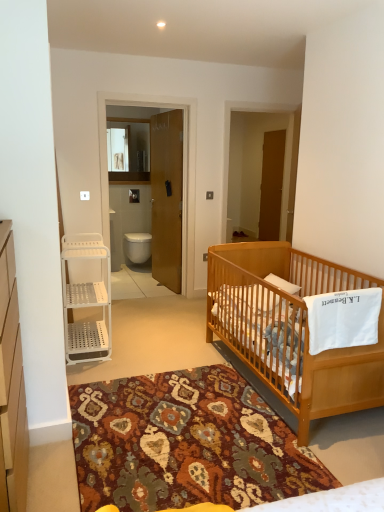
Locate an element on the screen. Image resolution: width=384 pixels, height=512 pixels. free location above patterned carpet at center (from a real-world perspective) is located at coordinates (174, 386).